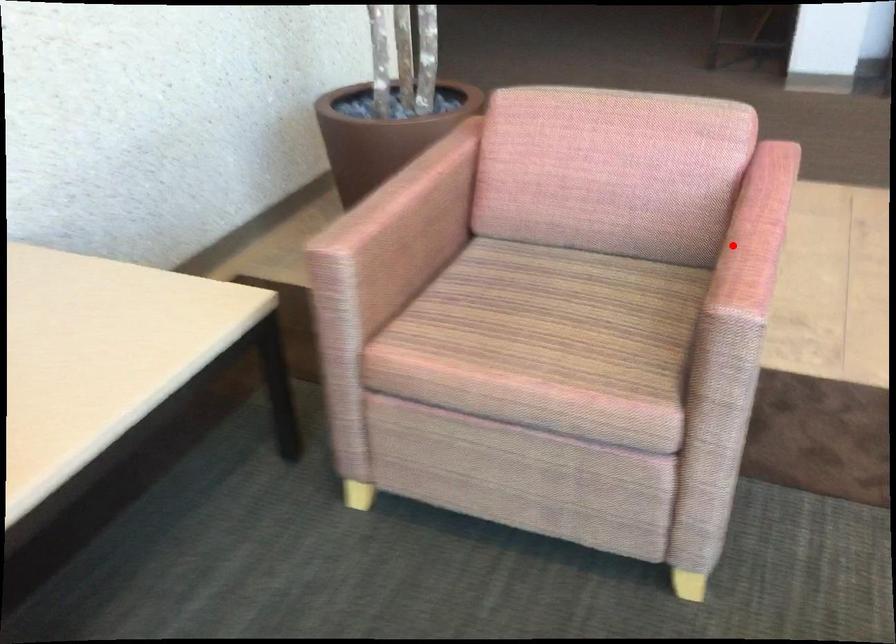
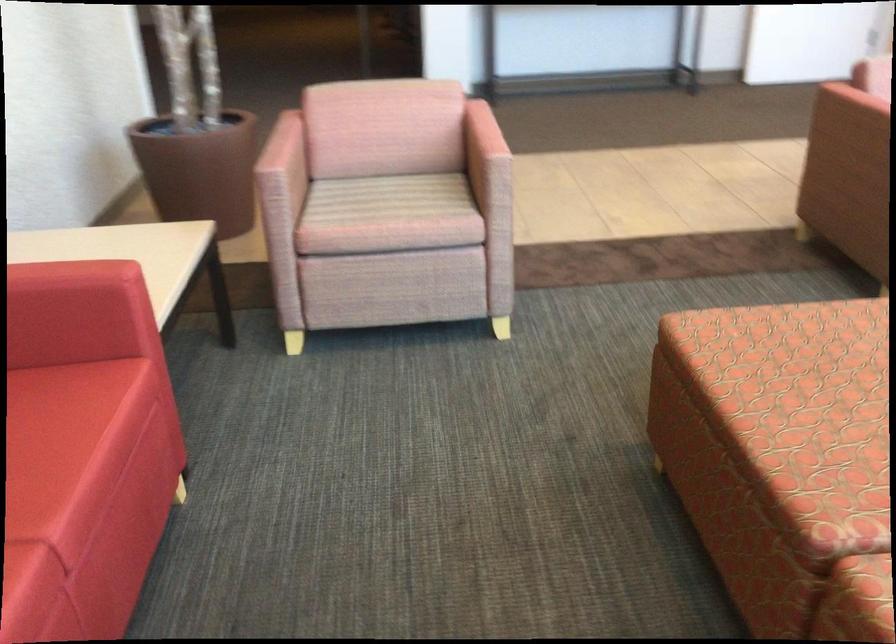
Question: I am providing you with two images of the same scene from different viewpoints. Image1 has a red point marked. In image2, the corresponding 3D location appears at what relative position? Reply with the corresponding letter.

Choices:
 (A) Closer
 (B) Farther

Answer: (B)